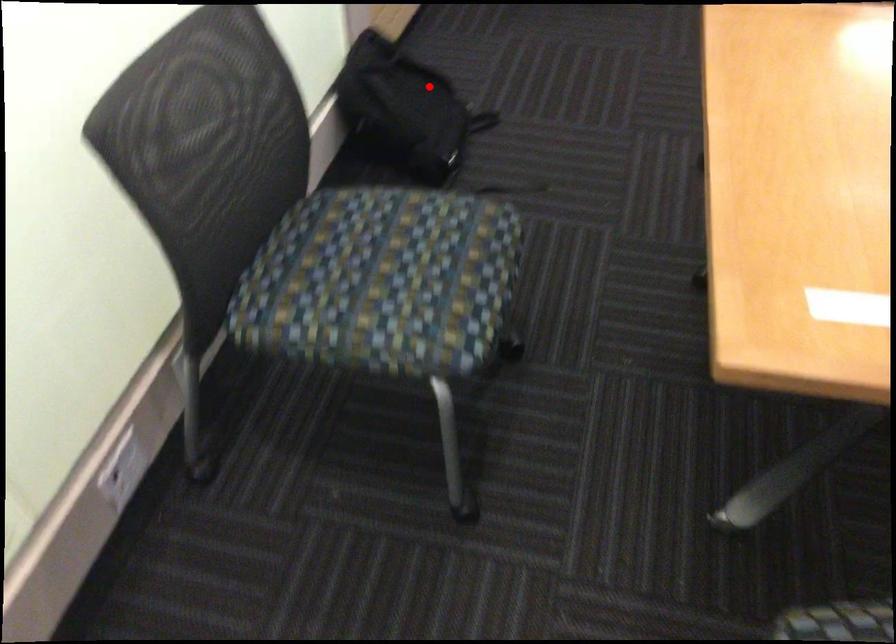
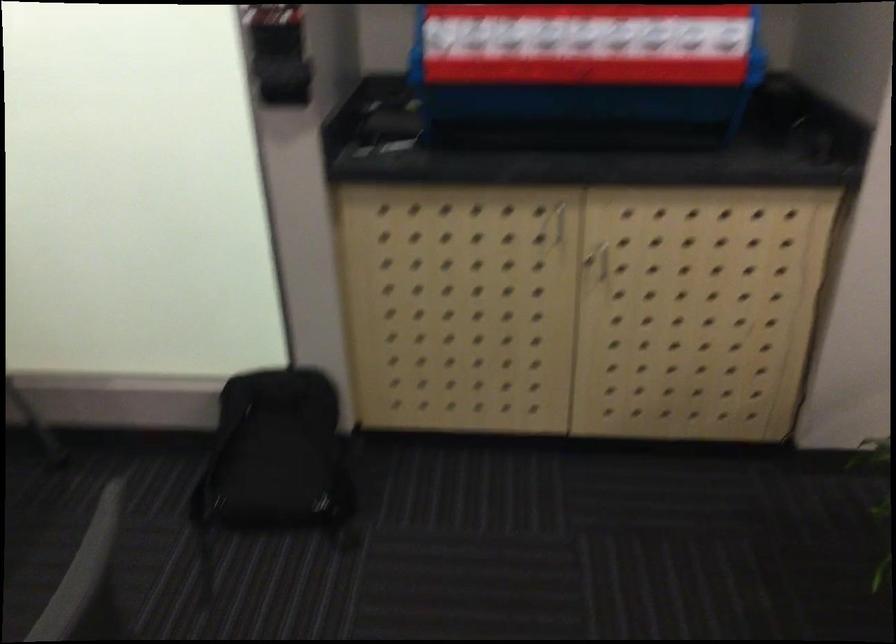
Find the pixel in the second image that matches the highlighted location in the first image.

(277, 455)